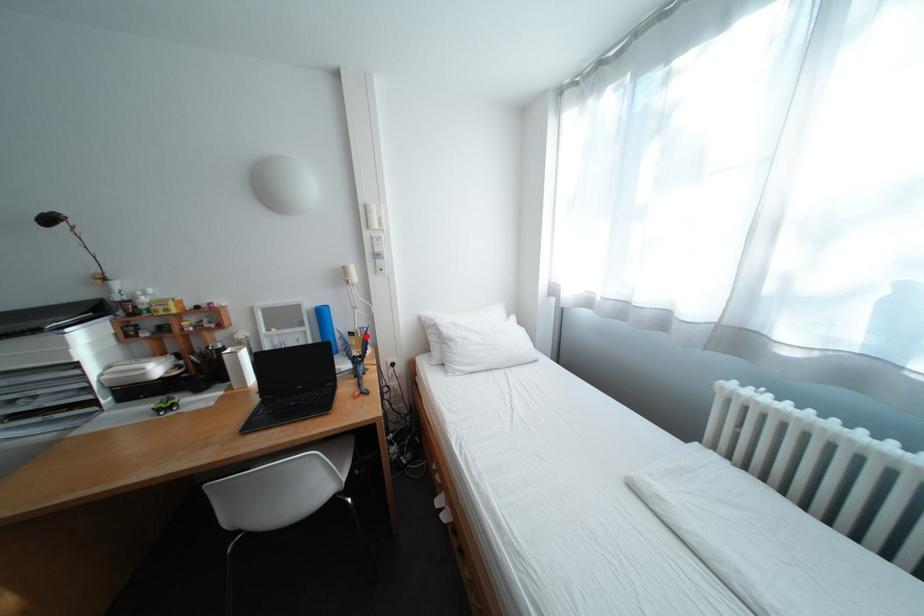
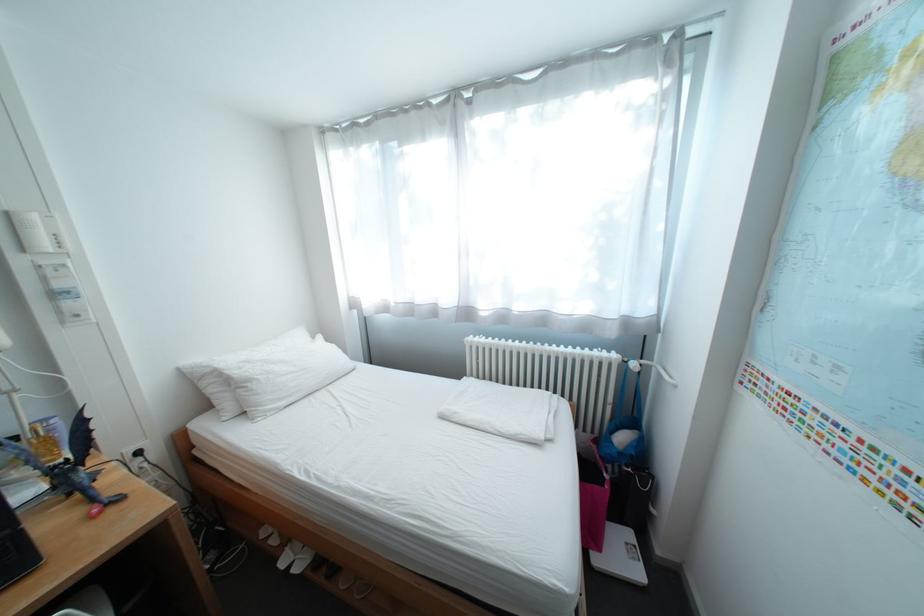
Locate, in the second image, the point that corresponds to the highlighted location in the first image.

(31, 440)